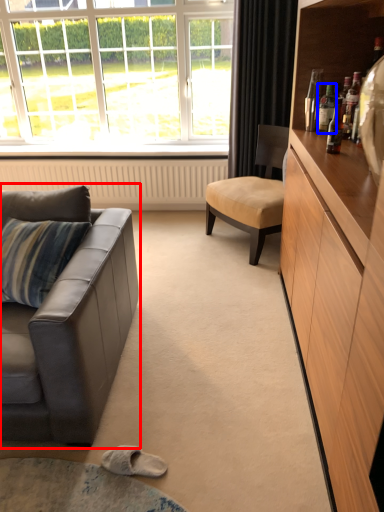
Question: Which object is further to the camera taking this photo, studio couch (highlighted by a red box) or bottle (highlighted by a blue box)?

Choices:
 (A) studio couch
 (B) bottle

Answer: (B)